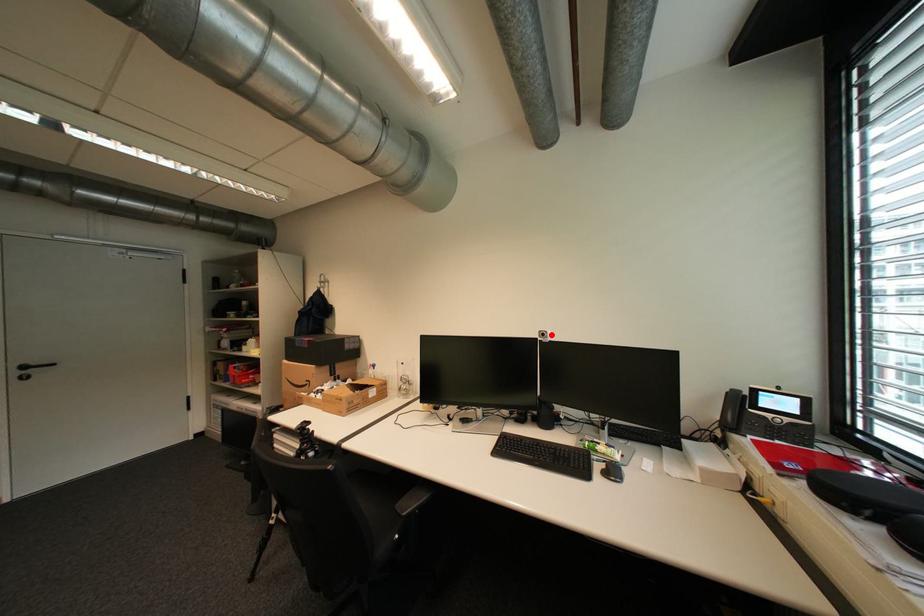
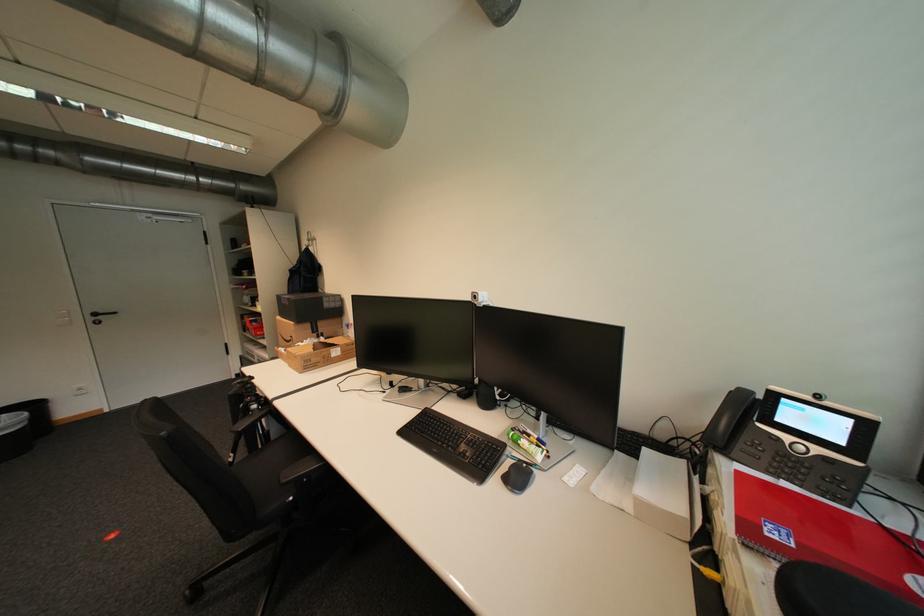
The point at the highlighted location is marked in the first image. Where is the corresponding point in the second image?

(483, 297)